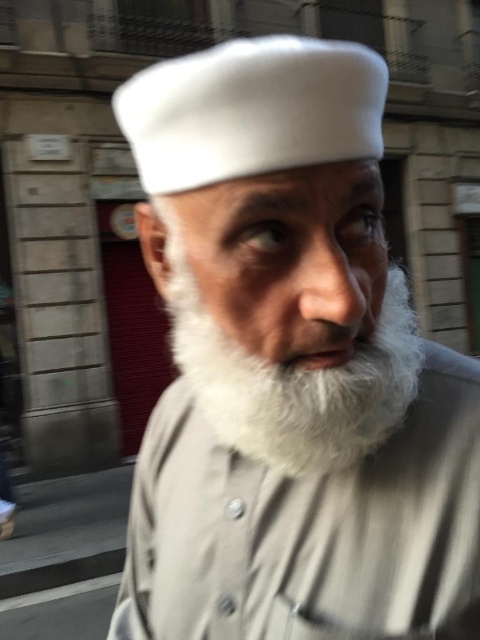
You are a photographer trying to capture the subject in the image. The subject has a white fur beard at center. If you want to focus on the exact point where the beard meets the cap, which is located at point coordinates of [309,529], can you confirm if this point is within the beard area?

Yes, the point at coordinates [309,529] corresponds to the white fur beard at center, so it is within the beard area.

You are a photographer trying to capture the details of the white fur beard at center and the white soft beard at center. Which part of the beard is located more to the left?

The white fur beard at center is positioned on the left side of white soft beard at center, so the white fur beard at center is more to the left.

You are a photographer adjusting the framing for a portrait. You notice two beards in the center of the image, a white fur beard at center and a white soft beard at center. Which one should you focus on to ensure it occupies more space in the frame?

The white fur beard at center has a larger width than the white soft beard at center, so focusing on the white fur beard at center will ensure it occupies more space in the frame.